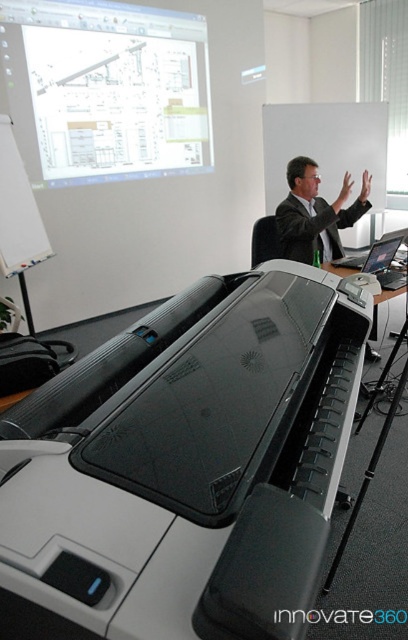
Question: Which point is closer to the camera?

Choices:
 (A) (166, 33)
 (B) (290, 257)

Answer: (B)

Question: Which object appears closest to the camera in this image?

Choices:
 (A) dark gray suit at upper center
 (B) matte black laptop at center
 (C) black plastic printer at center
 (D) glossy plastic laptop at upper right

Answer: (C)

Question: Which of the following is the farthest from the observer?

Choices:
 (A) (53, 515)
 (B) (323, 205)
 (C) (370, 250)

Answer: (C)

Question: Is black plastic printer at center positioned in front of white glossy projection screen at upper left?

Choices:
 (A) no
 (B) yes

Answer: (B)

Question: Does dark gray suit at upper center have a smaller size compared to matte black laptop at center?

Choices:
 (A) no
 (B) yes

Answer: (A)

Question: Is dark gray suit at upper center bigger than glossy plastic laptop at upper right?

Choices:
 (A) no
 (B) yes

Answer: (B)